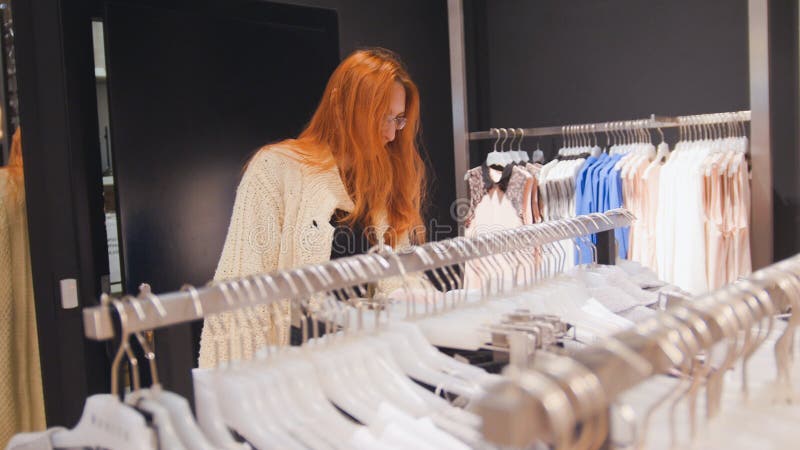
Locate an element on the screen. This screenshot has height=450, width=800. inside of room behind black door is located at coordinates coord(109,183).